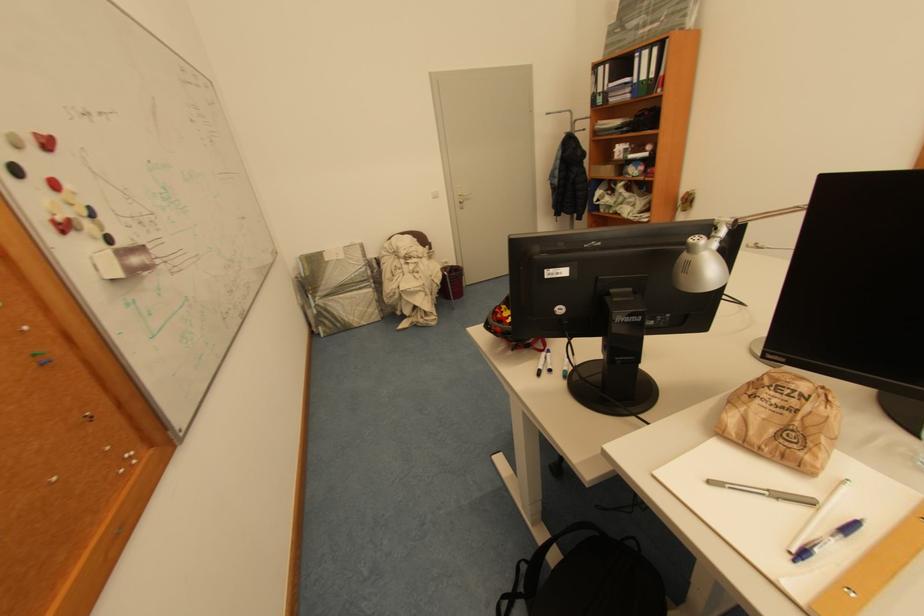
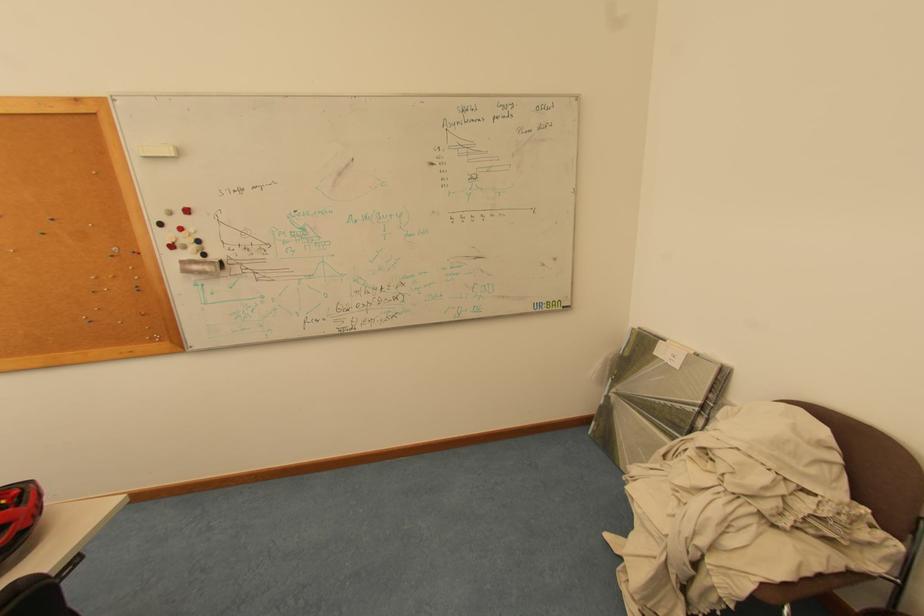
Find the pixel in the second image that matches (325,300) in the first image.

(622, 392)